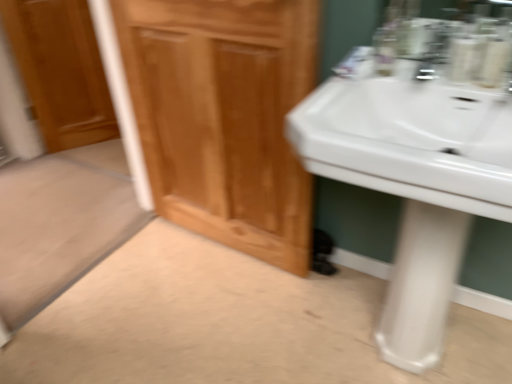
Where is `free space behind white glossy pedestal at lower right`? This screenshot has height=384, width=512. free space behind white glossy pedestal at lower right is located at coordinates (364, 292).